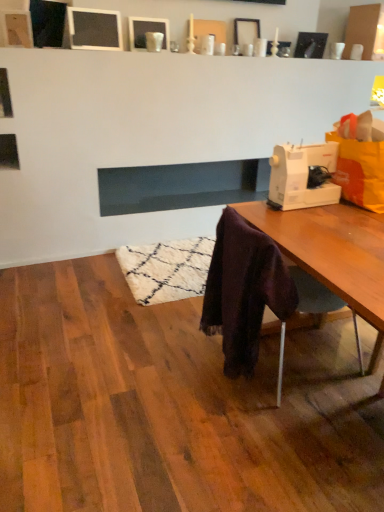
Find the location of a particular element. vacant region in front of velvet purple scarf at lower right is located at coordinates [283, 444].